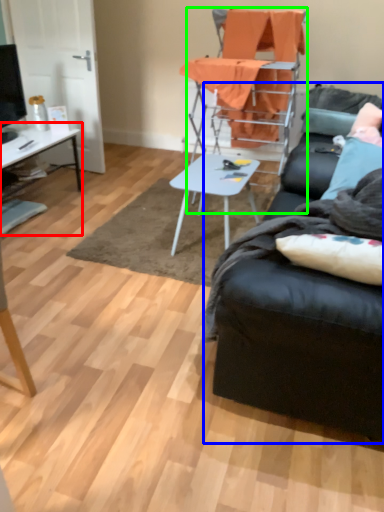
Question: Which object is the farthest from desk (highlighted by a red box)? Choose among these: studio couch (highlighted by a blue box) or chair (highlighted by a green box).

Choices:
 (A) studio couch
 (B) chair

Answer: (A)